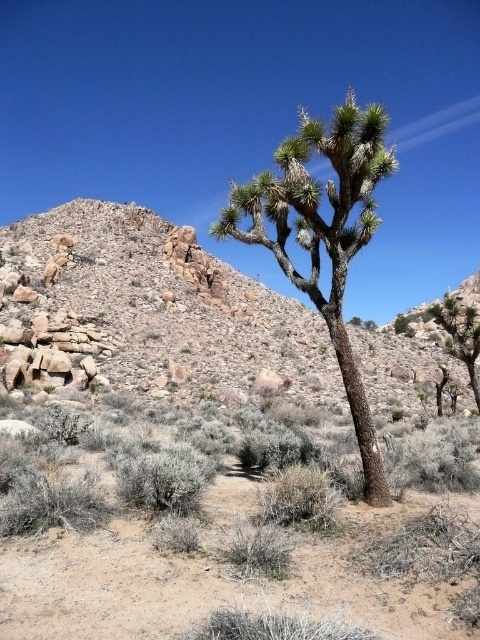
Between rocky desert at upper left and green spiky tree at center, which one has more height?

green spiky tree at center

Which is in front, point (46, 221) or point (345, 387)?

Point (345, 387) is more forward.

I want to click on rocky desert at upper left, so click(168, 298).

Which is more to the right, green spiky tree at center or green spiky plant at right?

From the viewer's perspective, green spiky plant at right appears more on the right side.

Is point (348, 120) farther from camera compared to point (447, 336)?

No.

Locate an element on the screen. This screenshot has width=480, height=640. green spiky tree at center is located at coordinates (324, 234).

How far apart are rocky desert at upper left and green spiky plant at right?

The distance of rocky desert at upper left from green spiky plant at right is 45.23 meters.

Does rocky desert at upper left appear on the right side of green spiky plant at right?

Incorrect, rocky desert at upper left is not on the right side of green spiky plant at right.

This screenshot has height=640, width=480. Describe the element at coordinates (168, 298) in the screenshot. I see `rocky desert at upper left` at that location.

At what (x,y) coordinates should I click in order to perform the action: click on rocky desert at upper left. Please return your answer as a coordinate pair (x, y). This screenshot has height=640, width=480. Looking at the image, I should click on (168, 298).